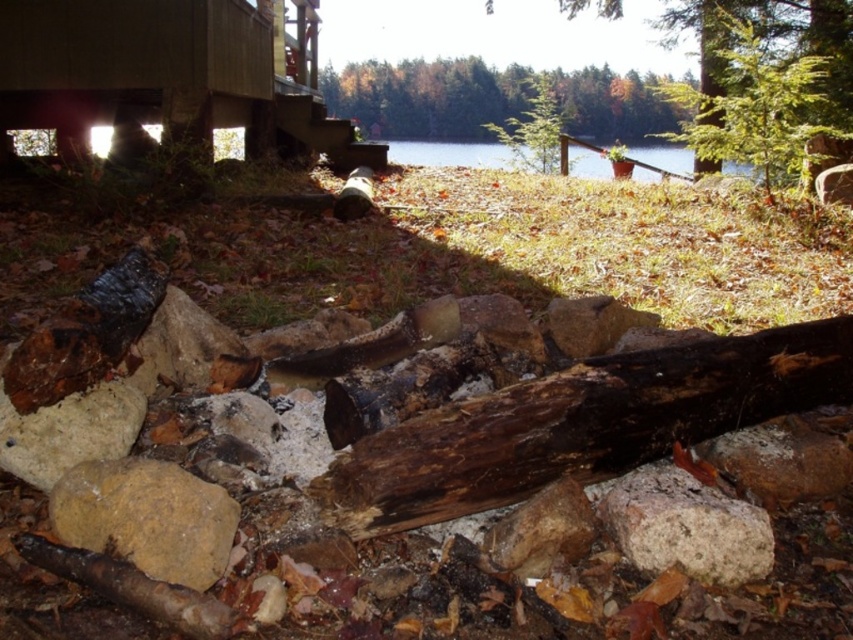
Does green leafy tree at upper right appear over green leafy tree at upper center?

No, green leafy tree at upper right is not above green leafy tree at upper center.

Based on the photo, does green leafy tree at upper right appear on the right side of green leafy tree at upper center?

Yes, green leafy tree at upper right is to the right of green leafy tree at upper center.

Between point (752, 157) and point (666, 109), which one is positioned in front?

Point (752, 157) is in front.

Find the location of a particular element. The width and height of the screenshot is (853, 640). green leafy tree at upper right is located at coordinates (767, 76).

Who is positioned more to the left, green leafy tree at upper center or speckled brown rock at center?

speckled brown rock at center is more to the left.

Is green leafy tree at upper center below speckled brown rock at center?

No.

Is point (453, 64) positioned behind point (692, 476)?

Yes, point (453, 64) is behind point (692, 476).

Image resolution: width=853 pixels, height=640 pixels. I want to click on green leafy tree at upper center, so click(x=427, y=97).

Does point (405, 112) come farther from viewer compared to point (74, 449)?

Yes, point (405, 112) is farther from viewer.

Can you confirm if green leafy tree at upper center is positioned above white rough rock at lower left?

Correct, green leafy tree at upper center is located above white rough rock at lower left.

Between point (637, 115) and point (42, 464), which one is positioned behind?

Positioned behind is point (637, 115).

Find the location of a particular element. green leafy tree at upper center is located at coordinates (427, 97).